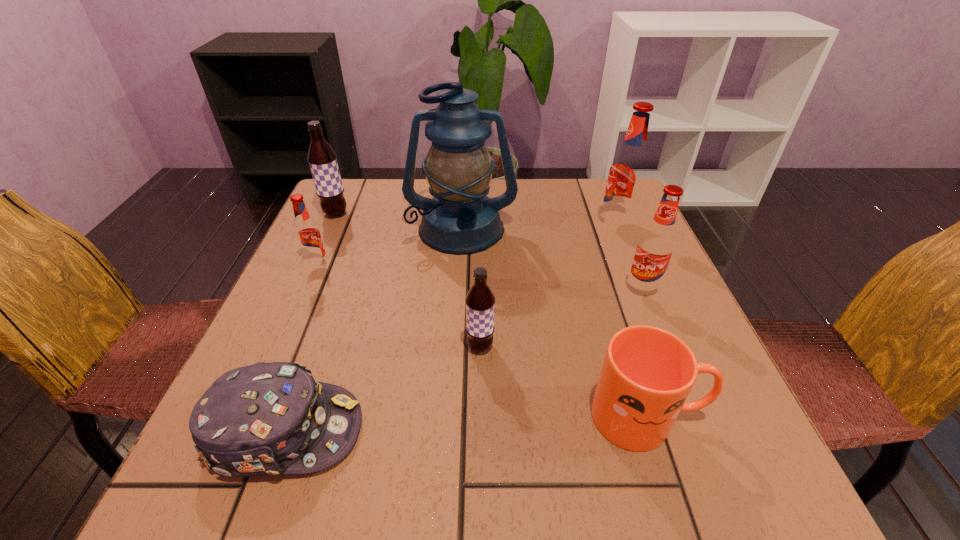
This screenshot has width=960, height=540. I want to click on blue lantern, so click(x=460, y=219).

The height and width of the screenshot is (540, 960). I want to click on the biggest red root beer, so click(x=628, y=171).

This screenshot has height=540, width=960. I want to click on the farthest red root beer, so click(x=628, y=171).

The height and width of the screenshot is (540, 960). In order to click on the bigger brown root beer in this screenshot , I will do `click(322, 159)`.

You are a GUI agent. You are given a task and a screenshot of the screen. Output one action in this format:
    pyautogui.click(x=<x>, y=<y>)
    Task: Click on the farther brown root beer
    The width and height of the screenshot is (960, 540).
    Given the screenshot: What is the action you would take?
    pyautogui.click(x=322, y=159)

Where is `the fourth nearest object`? The image size is (960, 540). the fourth nearest object is located at coordinates (656, 245).

You are a GUI agent. You are given a task and a screenshot of the screen. Output one action in this format:
    pyautogui.click(x=<x>, y=<y>)
    Task: Click on the second biggest red root beer
    The width and height of the screenshot is (960, 540).
    Given the screenshot: What is the action you would take?
    pyautogui.click(x=656, y=245)

The height and width of the screenshot is (540, 960). I want to click on the smallest red root beer, so click(308, 237).

Find the location of a particular element. the third farthest root beer is located at coordinates (308, 237).

You are a GUI agent. You are given a task and a screenshot of the screen. Output one action in this format:
    pyautogui.click(x=<x>, y=<y>)
    Task: Click on the nearest root beer
    This screenshot has height=540, width=960.
    Given the screenshot: What is the action you would take?
    pyautogui.click(x=480, y=301)